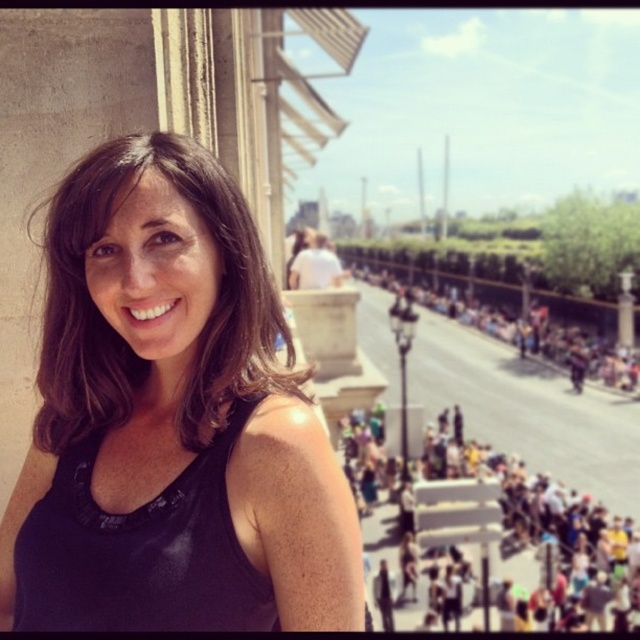
Based on the photo, does multicolored fabric crowd at lower right have a greater height compared to dark gray concrete crowd at center?

No, multicolored fabric crowd at lower right is not taller than dark gray concrete crowd at center.

What do you see at coordinates (481, 515) in the screenshot? I see `multicolored fabric crowd at lower right` at bounding box center [481, 515].

Between point (531, 596) and point (632, 362), which one is positioned in front?

Point (531, 596)

The height and width of the screenshot is (640, 640). What are the coordinates of `multicolored fabric crowd at lower right` in the screenshot? It's located at (481, 515).

Is point (36, 554) farther from viewer compared to point (602, 339)?

That is False.

Is black matte vest at upper left further to the viewer compared to dark gray concrete crowd at center?

That is False.

Who is more forward, (72, 508) or (504, 336)?

Point (72, 508) is more forward.

Locate an element on the screen. This screenshot has width=640, height=640. black matte vest at upper left is located at coordinates (140, 552).

Between dark brown hair at center and dark gray concrete crowd at center, which one appears on the right side from the viewer's perspective?

dark gray concrete crowd at center is more to the right.

Is dark brown hair at center to the left of dark gray concrete crowd at center from the viewer's perspective?

Yes, dark brown hair at center is to the left of dark gray concrete crowd at center.

The image size is (640, 640). I want to click on dark brown hair at center, so click(116, 330).